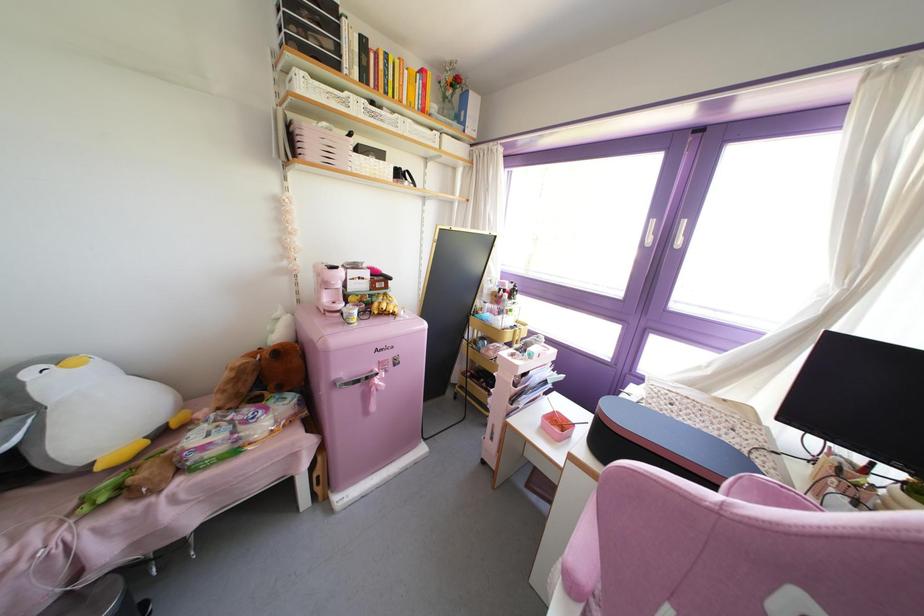
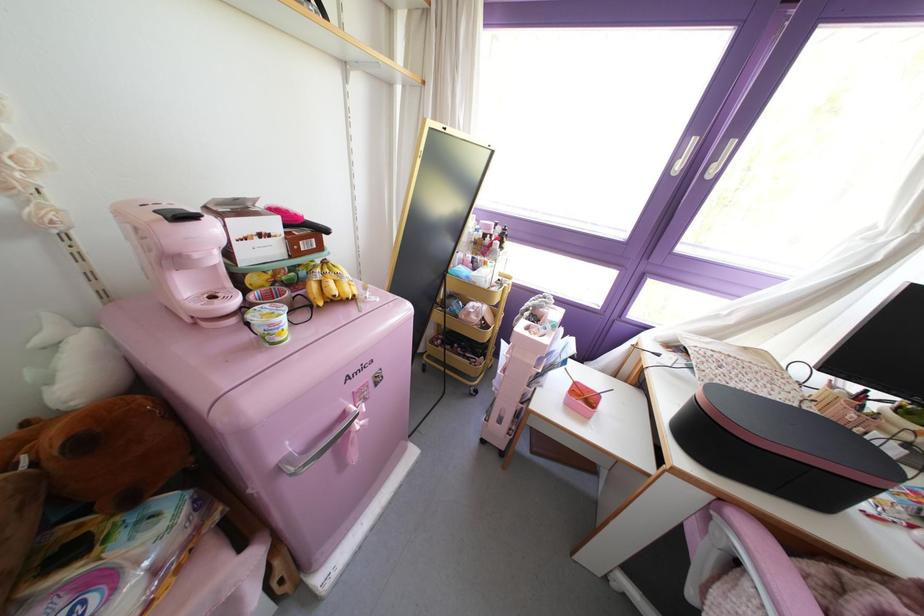
Which direction would the cameraman need to move to produce the second image?

The cameraman walked toward left, forward.